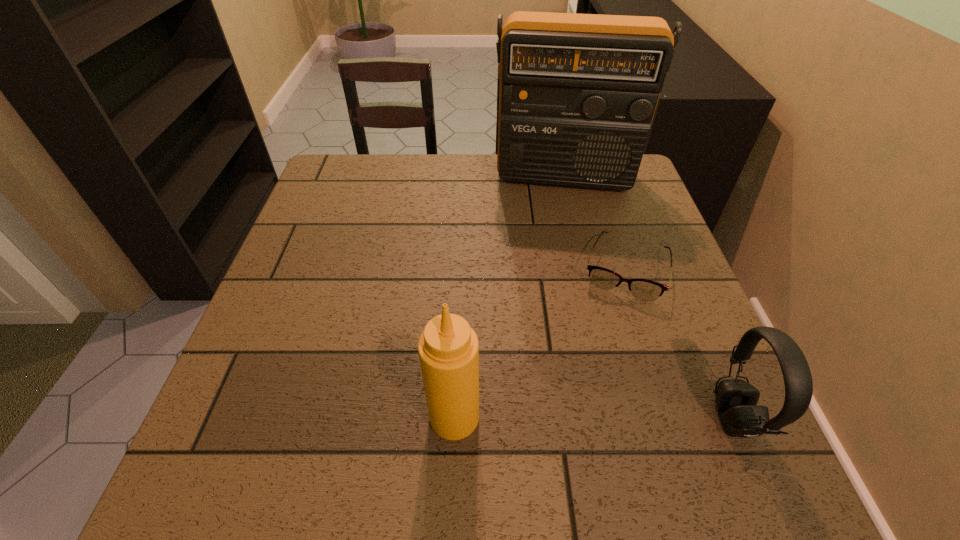
Where is `headset situated at the right edge`? The image size is (960, 540). headset situated at the right edge is located at coordinates (736, 400).

Find the location of a particular element. spectacles situated at the right edge is located at coordinates (643, 289).

At what (x,y) coordinates should I click in order to perform the action: click on radio receiver that is at the right edge. Please return your answer as a coordinate pair (x, y). The width and height of the screenshot is (960, 540). Looking at the image, I should click on (577, 95).

At what (x,y) coordinates should I click in order to perform the action: click on object positioned at the far right corner. Please return your answer as a coordinate pair (x, y). The image size is (960, 540). Looking at the image, I should click on (577, 95).

Where is `object at the near right corner`? object at the near right corner is located at coordinates (736, 400).

Find the location of a particular element. This screenshot has height=540, width=960. free spot at the far edge of the desktop is located at coordinates coord(508,183).

The width and height of the screenshot is (960, 540). I want to click on vacant space at the left edge of the desktop, so click(335, 257).

The image size is (960, 540). In order to click on free space at the right edge in this screenshot , I will do `click(709, 381)`.

The height and width of the screenshot is (540, 960). Identify the location of vacant space at the far left corner of the desktop. point(356,193).

Identify the location of vacant space at the near left corner. This screenshot has width=960, height=540. (274, 431).